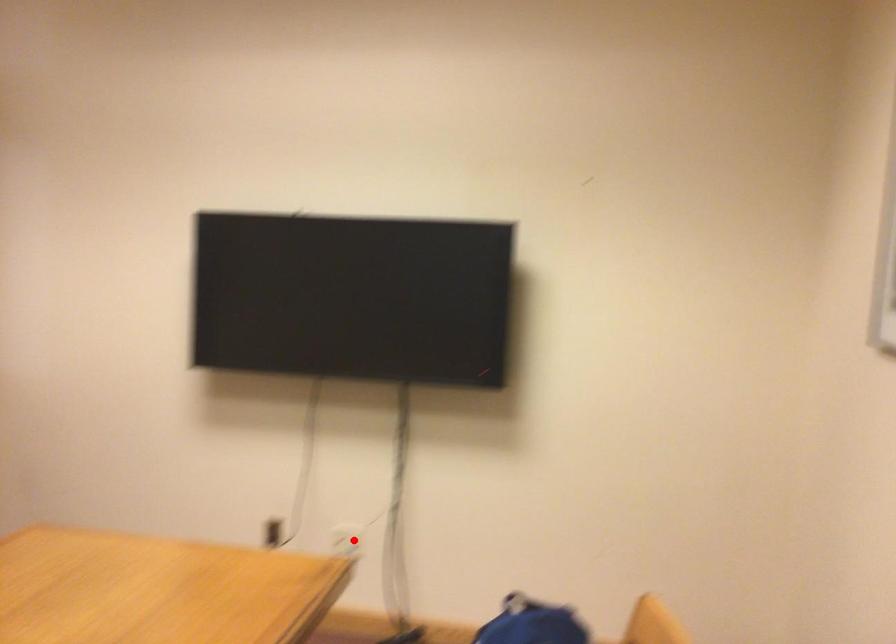
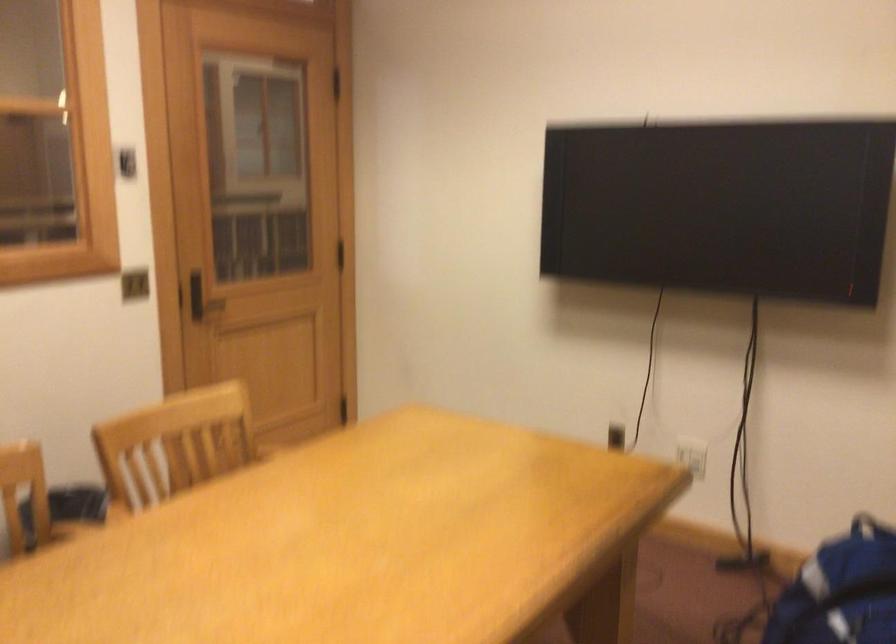
The point at the highlighted location is marked in the first image. Where is the corresponding point in the second image?

(692, 455)